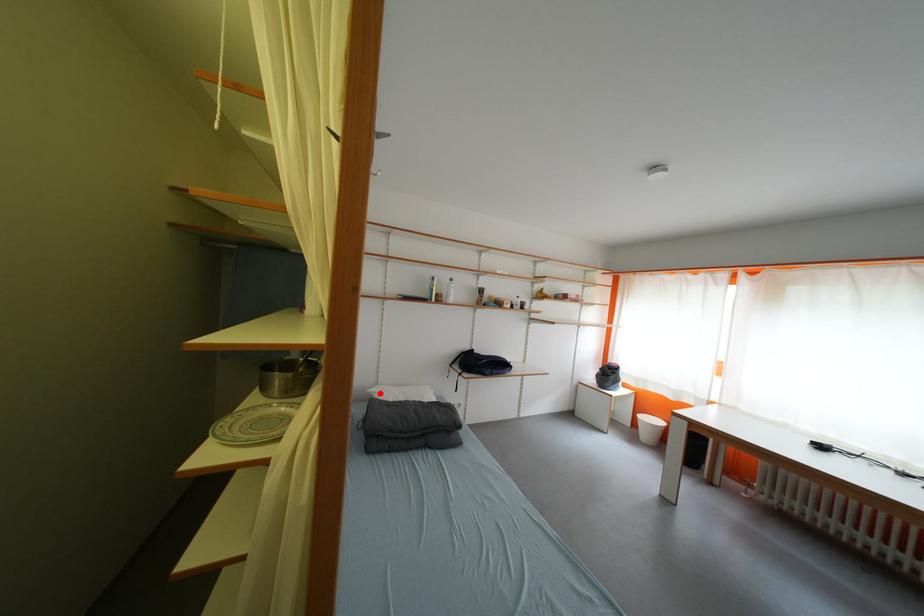
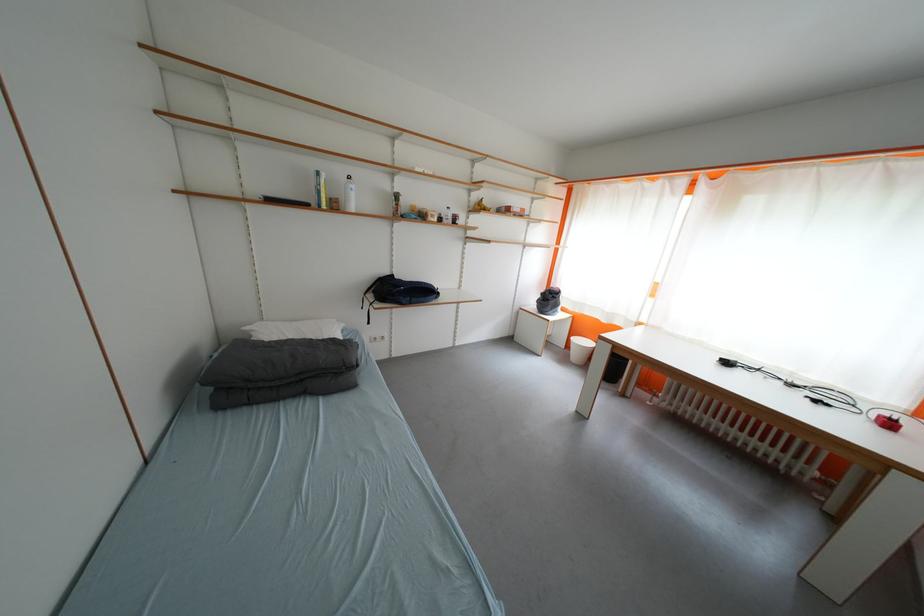
Find the pixel in the second image that matches the highlighted location in the first image.

(257, 331)